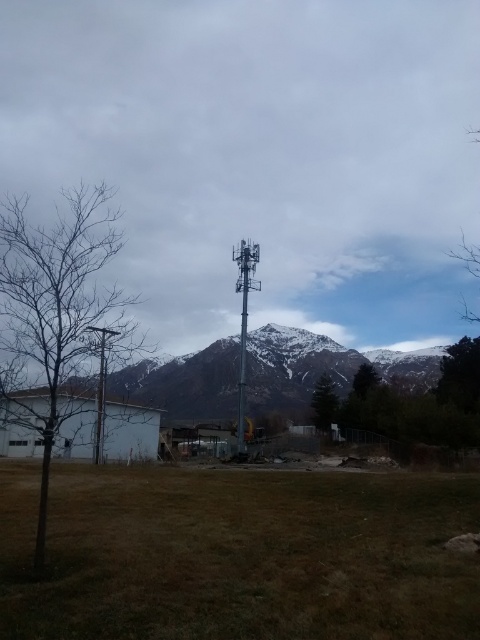
Measure the distance between green grass at center and camera.

The distance of green grass at center from camera is 12.76 feet.

Consider the image. Can you confirm if green grass at center is shorter than snowy metallic pole at center?

Yes, green grass at center is shorter than snowy metallic pole at center.

Find the location of a particular element. Image resolution: width=480 pixels, height=640 pixels. green grass at center is located at coordinates (239, 554).

Locate an element on the screen. This screenshot has width=480, height=640. green grass at center is located at coordinates (239, 554).

Which of these two, snowy metallic pole at center or metallic gray telegraph pole at center, stands shorter?

With less height is snowy metallic pole at center.

Can you confirm if snowy metallic pole at center is smaller than metallic gray telegraph pole at center?

No.

Which is behind, point (144, 403) or point (241, 378)?

The point (144, 403) is behind.

Locate an element on the screen. The image size is (480, 640). snowy metallic pole at center is located at coordinates tap(322, 369).

Can you confirm if bare branches at left is positioned below metallic pole at left?

No.

Which is more to the right, bare branches at left or metallic pole at left?

metallic pole at left

The height and width of the screenshot is (640, 480). In order to click on bare branches at left in this screenshot , I will do `click(59, 308)`.